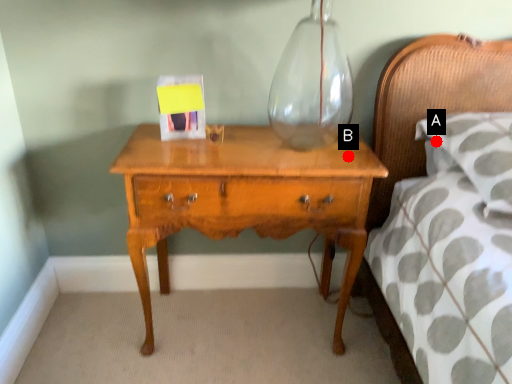
Question: Two points are circled on the image, labeled by A and B beside each circle. Which point is farther to the camera?

Choices:
 (A) A is further
 (B) B is further

Answer: (A)